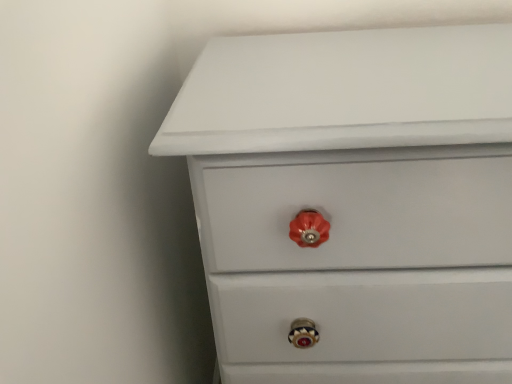
The width and height of the screenshot is (512, 384). Describe the element at coordinates (354, 202) in the screenshot. I see `white glossy chest of drawers at upper center` at that location.

I want to click on white glossy chest of drawers at upper center, so click(354, 202).

At what (x,y) coordinates should I click in order to perform the action: click on white glossy chest of drawers at upper center. Please return your answer as a coordinate pair (x, y). This screenshot has height=384, width=512. Looking at the image, I should click on (354, 202).